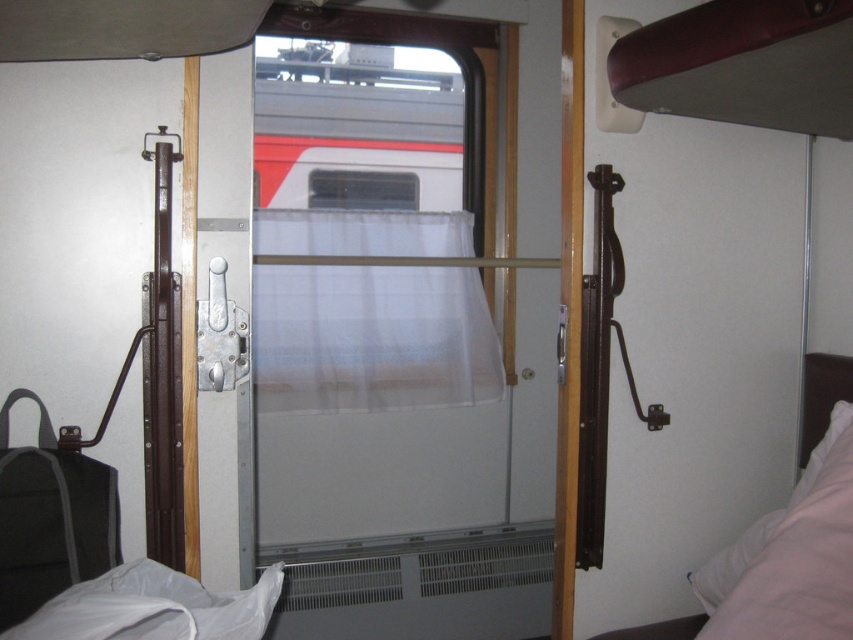
You are standing inside the train compartment and want to reach both points marked on the wall. Which point, point 1 at coordinates point (828, 625) or point 2 at coordinates point (816, 371), is closer to you when facing the window?

Point 1 at coordinates point (828, 625) is closer to you because it is in front of point 2 at coordinates point (816, 371).

You are a traveler who wants to sleep comfortably on the white soft bed at right. However, you need to ensure there is enough space between the bed and the transparent plastic window at center for your legs. Based on the scene, can you determine if the bed is narrow enough to allow this?

The white soft bed at right has a lesser width compared to the transparent plastic window at center, so there should be sufficient space between them for your legs.

Consider the image. You are a traveler who just boarded the train and wants to sleep comfortably. The white soft bed at right is available. However, you are concerned about the distance between the bed and the transparent plastic window at center because you want to avoid direct sunlight. Can you confirm if the distance is sufficient to block sunlight from reaching the bed?

The white soft bed at right is 4.73 feet away from the transparent plastic window at center. Since the distance is substantial, it should block most direct sunlight from reaching the bed, allowing you to sleep comfortably.